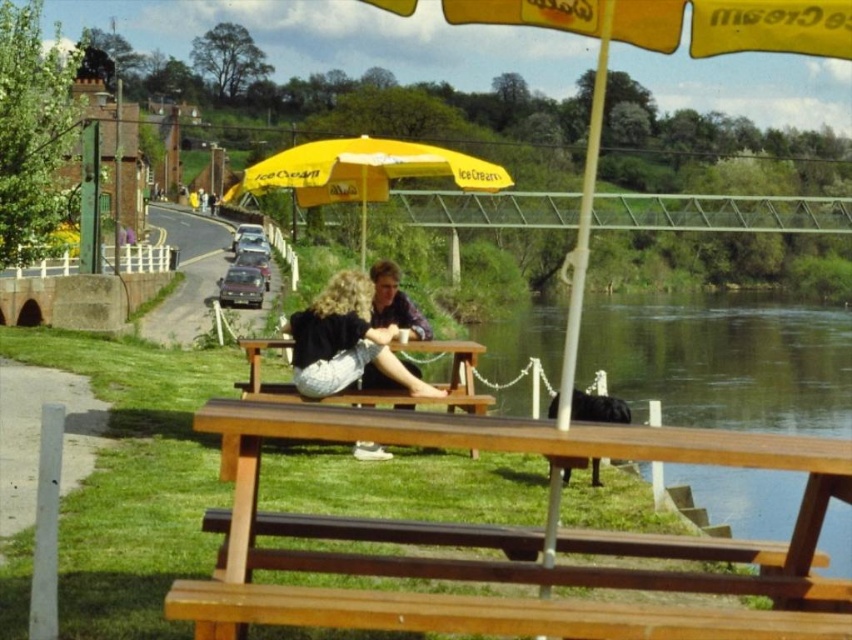
From the picture: You are standing at the riverside and want to walk from point A to point B. Point A is located at coordinates point (786, 401) and point B is at point (406, 314). Which point is closer to you when you start walking?

Point A at point (786, 401) is closer to you than point B at point (406, 314) because it is further to the viewer, meaning it is nearer in the scene.

You are standing at the riverside and want to take a photo of both the point at coordinates point (326, 294) and point (363, 381). Which point should you focus on first to ensure both are in focus?

You should focus on point (326, 294) first because it is closer to the camera than point (363, 381). This ensures that both points will be within the depth of field.